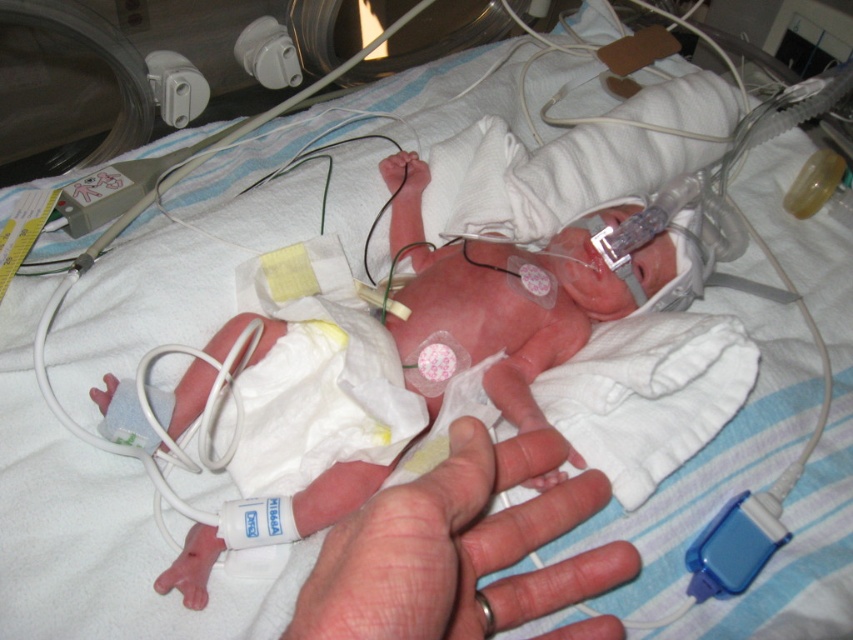
You are a nurse in a neonatal unit. You need to place a rubber teething ring at lower center into the mouth of the newborn baby. The baby has a smooth skin hand at center. Can the baby reach the teething ring with its hand?

The smooth skin hand at center is above the rubber teething ring at lower center, so the baby can reach the teething ring with its hand.

You are a nurse in the neonatal unit. You need to place the rubber teething ring at lower center into the smooth skin hand at center. Is the hand currently positioned in a way that allows you to easily place the teething ring into it?

The smooth skin hand at center is positioned on the left side of the rubber teething ring at lower center, so the hand is to the left of the teething ring. To place the teething ring into the hand, you would need to move the hand closer to the ring or move the ring towards the hand. Since the hand is on the left, you might need to adjust their positions to ensure the hand can grasp the teething ring.

You are a nurse in a hospital. You need to place a rubber teething ring at lower center into the hand of the newborn baby whose smooth skin hand at center is visible. Can you reach the teething ring with the baby hand?

The distance between the smooth skin hand at center and the rubber teething ring at lower center is 2.63 inches, so the baby can easily reach the rubber teething ring at lower center with its hand.